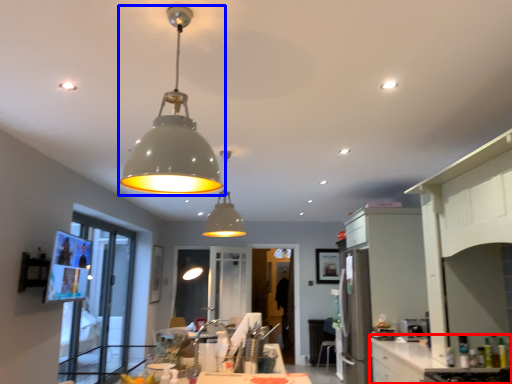
Question: Which object is closer to the camera taking this photo, counter top (highlighted by a red box) or lamp (highlighted by a blue box)?

Choices:
 (A) counter top
 (B) lamp

Answer: (B)